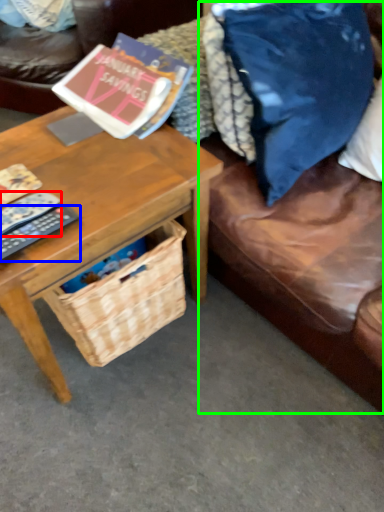
Question: Considering the real-world distances, which object is closest to remote control (highlighted by a red box)? remote control (highlighted by a blue box) or couch (highlighted by a green box).

Choices:
 (A) remote control
 (B) couch

Answer: (A)